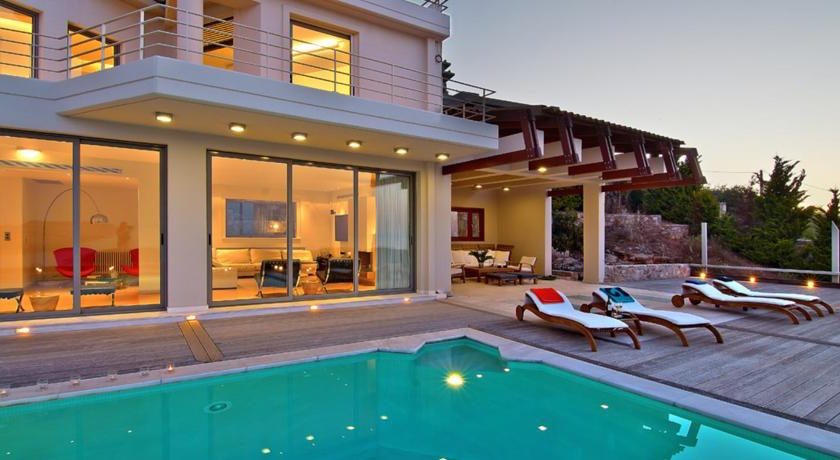
The width and height of the screenshot is (840, 460). I want to click on upper windows, so click(307, 63), click(27, 47).